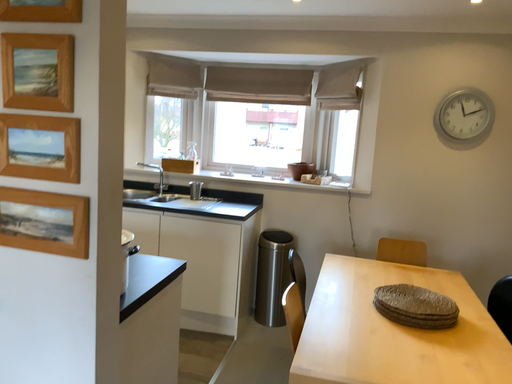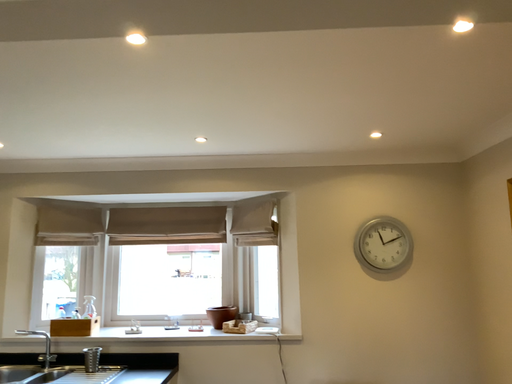
Question: How did the camera likely rotate when shooting the video?

Choices:
 (A) rotated right
 (B) rotated left

Answer: (A)